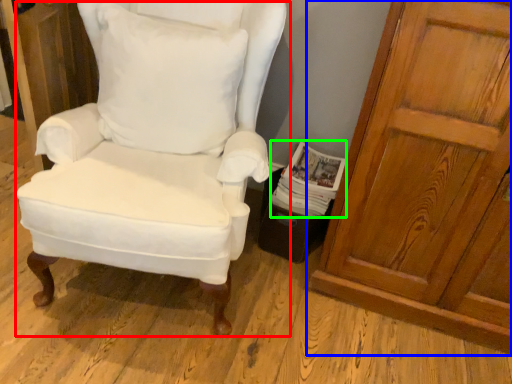
Question: Considering the real-world distances, which object is closest to chair (highlighted by a red box)? door (highlighted by a blue box) or magazine (highlighted by a green box).

Choices:
 (A) door
 (B) magazine

Answer: (B)